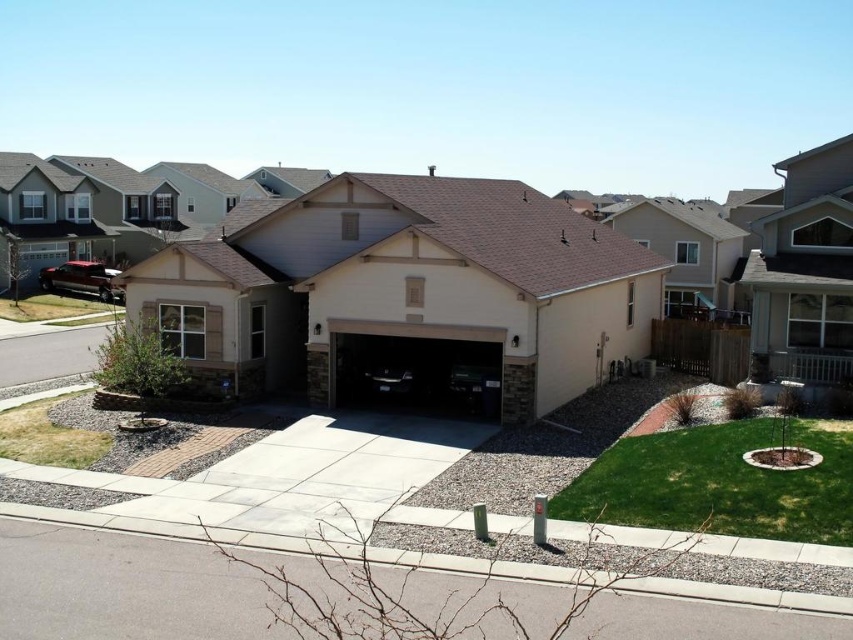
You are a delivery person trying to park your van in the driveway. The beige stucco garage at center and the gray concrete driveway at center are both options. According to the scene, which one is positioned higher and thus more suitable for parking on the higher ground?

The beige stucco garage at center is above the gray concrete driveway at center, so it is positioned higher and more suitable for parking on higher ground.

You are a delivery person with a 40 feet long truck. You need to park your truck between the beige stucco garage at center and the gray concrete driveway at center. Is there enough space to park your truck without overlapping either structure?

The beige stucco garage at center and gray concrete driveway at center are 43.46 feet apart from each other. Since the truck is 40 feet long, there is enough space to park between them without overlapping either structure.

You are a delivery person with a cart that is 2 meters wide. You need to move from the street to the front door. Is there enough space between the beige stucco garage at center and the matte black car at center to pass through with your cart?

The distance between the beige stucco garage at center and the matte black car at center is 5.46 meters. Since the cart is only 2 meters wide, there is sufficient space to pass through the 5.46 meter gap between them.